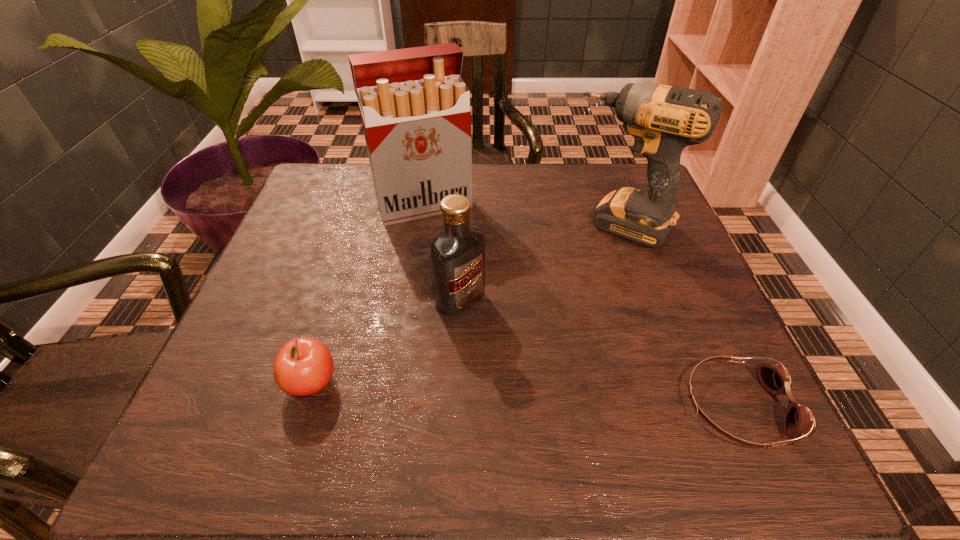
Locate an element on the screen. This screenshot has height=540, width=960. the second shortest object is located at coordinates (303, 366).

Image resolution: width=960 pixels, height=540 pixels. I want to click on goggles, so click(x=799, y=420).

Find the location of a particular element. cigarette case is located at coordinates (415, 108).

What are the coordinates of `drill` in the screenshot? It's located at (663, 120).

I want to click on the third farthest object, so click(x=457, y=254).

Identify the location of the third tallest object. (457, 254).

This screenshot has height=540, width=960. Find the location of `free space located on the right of the apple`. free space located on the right of the apple is located at coordinates (477, 383).

In order to click on free point located 0.380m with the lid open on the cigarette case in this screenshot , I will do `click(495, 346)`.

At what (x,y) coordinates should I click in order to perform the action: click on free region located 0.070m with the lid open on the cigarette case. Please return your answer as a coordinate pair (x, y). This screenshot has height=540, width=960. Looking at the image, I should click on (447, 242).

Locate an element on the screen. The height and width of the screenshot is (540, 960). vacant area located with the lid open on the cigarette case is located at coordinates (460, 271).